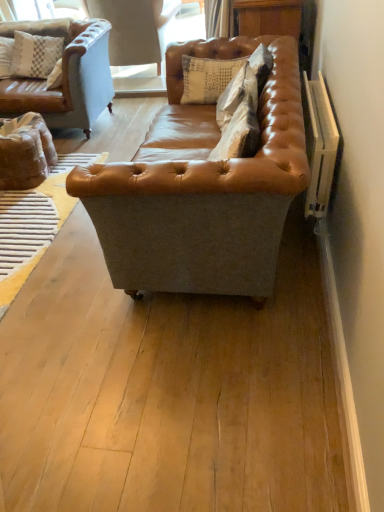
Question: Is light blue leather swivel chair at upper left further to camera compared to leather/cushion at center, which is the second pillow in front-to-back order?

Choices:
 (A) no
 (B) yes

Answer: (B)

Question: Are light blue leather swivel chair at upper left and leather/cushion at center, which ranks as the 2th pillow in bottom-to-top order, far apart?

Choices:
 (A) no
 (B) yes

Answer: (B)

Question: Can you confirm if light blue leather swivel chair at upper left is shorter than leather/cushion at center, which appears as the first pillow when viewed from the top?

Choices:
 (A) no
 (B) yes

Answer: (A)

Question: Is light blue leather swivel chair at upper left closer to the viewer compared to leather/cushion at center, which is the second pillow in front-to-back order?

Choices:
 (A) no
 (B) yes

Answer: (A)

Question: From a real-world perspective, is light blue leather swivel chair at upper left positioned under leather/cushion at center, acting as the 1th pillow starting from the back, based on gravity?

Choices:
 (A) yes
 (B) no

Answer: (A)

Question: From the image's perspective, is light blue leather swivel chair at upper left on top of leather/cushion at center, which ranks as the 2th pillow in bottom-to-top order?

Choices:
 (A) no
 (B) yes

Answer: (B)

Question: Is light blue leather swivel chair at upper left bigger than suede textured pillow at center, the second pillow viewed from the top?

Choices:
 (A) no
 (B) yes

Answer: (B)

Question: From a real-world perspective, is light blue leather swivel chair at upper left physically below suede textured pillow at center, the second pillow viewed from the top?

Choices:
 (A) yes
 (B) no

Answer: (A)

Question: Can you confirm if light blue leather swivel chair at upper left is wider than suede textured pillow at center, marked as the first pillow in a bottom-to-top arrangement?

Choices:
 (A) yes
 (B) no

Answer: (A)

Question: Does light blue leather swivel chair at upper left have a smaller size compared to suede textured pillow at center, marked as the first pillow in a bottom-to-top arrangement?

Choices:
 (A) no
 (B) yes

Answer: (A)

Question: Considering the relative sizes of light blue leather swivel chair at upper left and suede textured pillow at center, which is the first pillow from front to back, in the image provided, is light blue leather swivel chair at upper left shorter than suede textured pillow at center, which is the first pillow from front to back,?

Choices:
 (A) no
 (B) yes

Answer: (A)

Question: From the image's perspective, does light blue leather swivel chair at upper left appear higher than suede textured pillow at center, arranged as the second pillow when viewed from the back?

Choices:
 (A) yes
 (B) no

Answer: (A)

Question: From a real-world perspective, is suede textured pillow at center, the second pillow viewed from the top, positioned over saddle brown leather couch at center based on gravity?

Choices:
 (A) yes
 (B) no

Answer: (A)